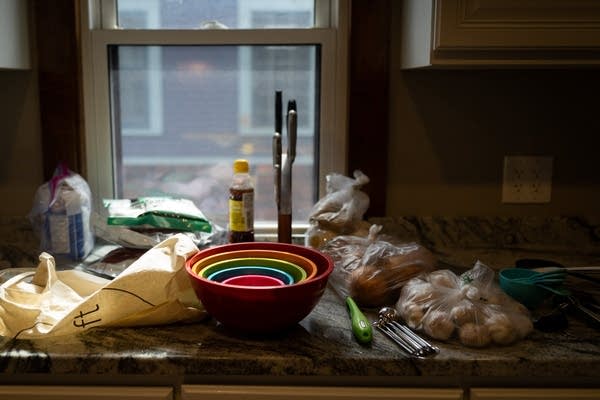
The width and height of the screenshot is (600, 400). In order to click on non-brick walls in this screenshot , I will do `click(445, 146)`, `click(23, 139)`.